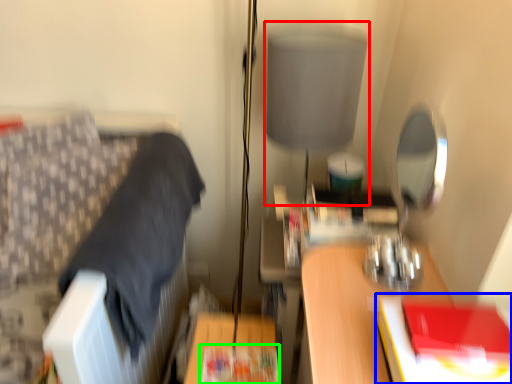
Question: Based on their relative distances, which object is farther from table lamp (highlighted by a red box)? Choose from paperback book (highlighted by a blue box) and paperback book (highlighted by a green box).

Choices:
 (A) paperback book
 (B) paperback book

Answer: (B)